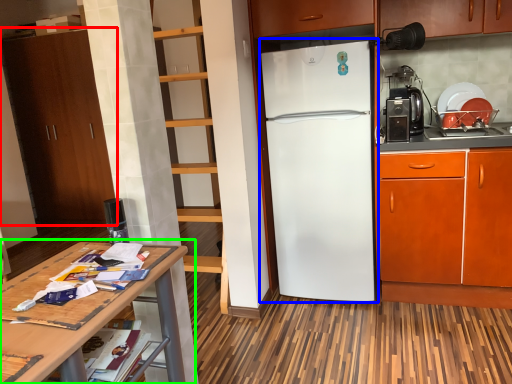
Question: Which object is positioned closest to cabinetry (highlighted by a red box)? Select from refrigerator (highlighted by a blue box) and table (highlighted by a green box).

Choices:
 (A) refrigerator
 (B) table

Answer: (A)